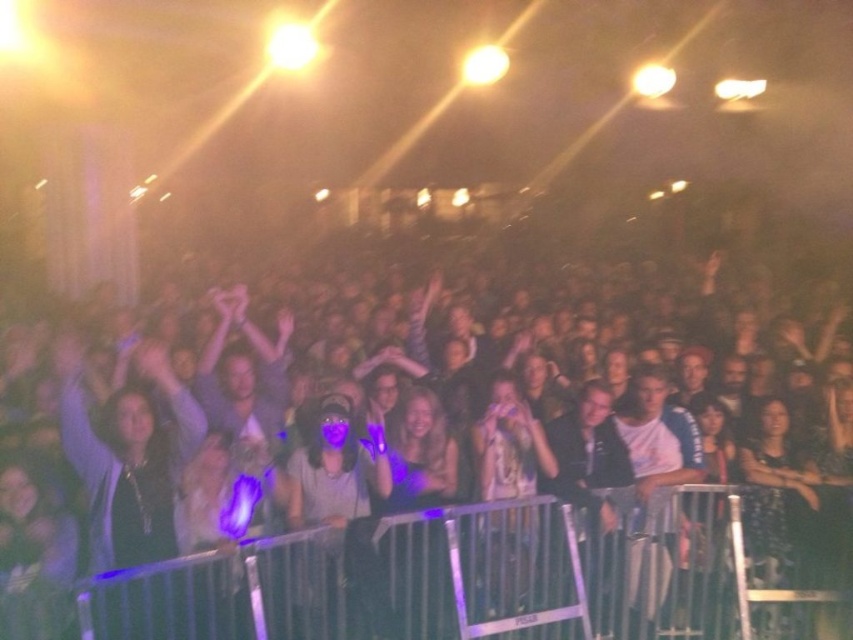
Question: Which point is farther to the camera?

Choices:
 (A) matte purple shirt at center
 (B) matte black crowd at center

Answer: (A)

Question: Is matte black crowd at center thinner than matte purple shirt at center?

Choices:
 (A) yes
 (B) no

Answer: (B)

Question: Is matte black crowd at center further to camera compared to matte purple shirt at center?

Choices:
 (A) no
 (B) yes

Answer: (A)

Question: Which point is farther to the camera?

Choices:
 (A) (349, 436)
 (B) (190, 598)

Answer: (A)

Question: Which object is closer to the camera taking this photo?

Choices:
 (A) matte black crowd at center
 (B) matte purple shirt at center

Answer: (A)

Question: Is matte black crowd at center to the left of matte purple shirt at center from the viewer's perspective?

Choices:
 (A) yes
 (B) no

Answer: (B)